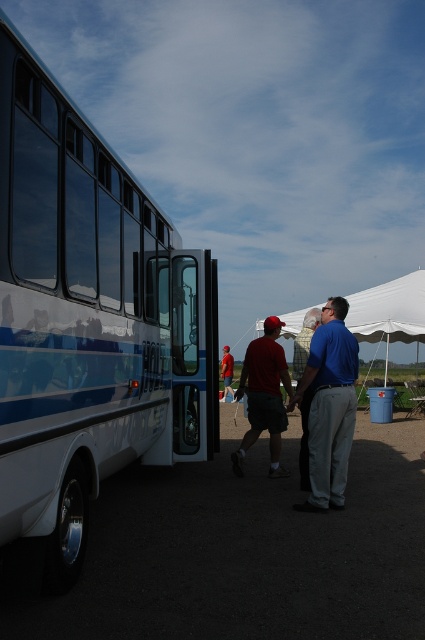
You are a photographer at the event and want to take a photo of both the blue smooth shirt at center and the blue fabric shirt at center. Since you can only focus on one person at a time, which one should you focus on first to ensure the other is still in the frame?

You should focus on the blue fabric shirt at center first because the blue smooth shirt at center is to the right of it, so capturing the leftmost person ensures the right one stays in frame.

You are a photographer at the event and want to capture a photo that includes both the blue smooth shirt at center and the blue fabric shirt at center. Which of the two shirts should you focus on to ensure the taller one is clearly visible in the photo?

The blue smooth shirt at center is taller than the blue fabric shirt at center, so focusing on the blue smooth shirt at center will ensure the taller one is clearly visible in the photo.

You are a photographer trying to capture a clear photo of the white glossy bus at left and the matte red cap at center. Since you want both objects to appear equally prominent in the photo, which object should you zoom in on more?

The white glossy bus at left is larger in size than the matte red cap at center, so you should zoom in more on the matte red cap at center to balance their prominence in the photo.